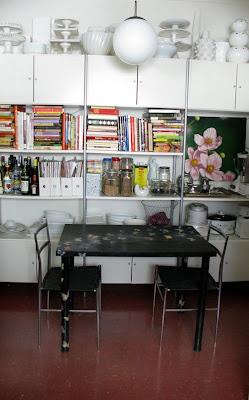
Locate an element on the screen. Image resolution: width=249 pixels, height=400 pixels. cardboard magazine holders is located at coordinates (76, 185), (67, 186), (51, 182), (41, 180).